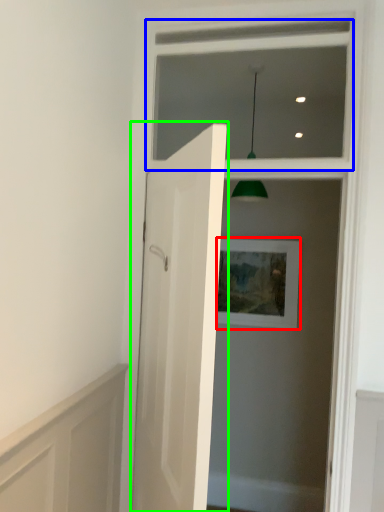
Question: Estimate the real-world distances between objects in this image. Which object is closer to picture frame (highlighted by a red box), window frame (highlighted by a blue box) or door (highlighted by a green box)?

Choices:
 (A) window frame
 (B) door

Answer: (A)